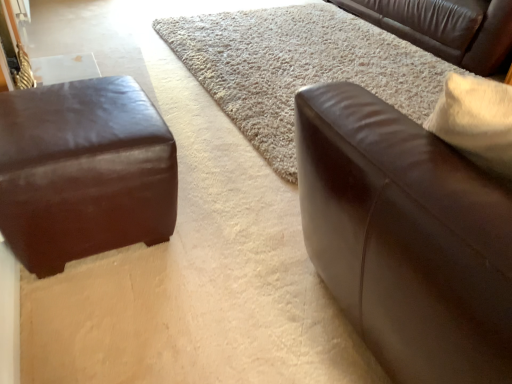
You are a GUI agent. You are given a task and a screenshot of the screen. Output one action in this format:
    pyautogui.click(x=<x>, y=<y>)
    Task: Click on the matte brown leather ottoman at left, positioned as the first studio couch in left-to-right order
    The width and height of the screenshot is (512, 384).
    Given the screenshot: What is the action you would take?
    pyautogui.click(x=84, y=171)

How much space does brown leather couch at upper right, acting as the 1th studio couch starting from the back, occupy vertically?

brown leather couch at upper right, acting as the 1th studio couch starting from the back, is 50.46 centimeters in height.

Where is `matte brown leather ottoman at left, arranged as the 2th studio couch when viewed from the back`? matte brown leather ottoman at left, arranged as the 2th studio couch when viewed from the back is located at coordinates (84, 171).

Is brown leather couch at upper right, the third studio couch from the left, positioned with its back to beige shag rug at center?

That's not correct — brown leather couch at upper right, the third studio couch from the left, is not looking away from beige shag rug at center.

From the image's perspective, which object appears higher, brown leather couch at upper right, acting as the third studio couch starting from the front, or beige shag rug at center?

brown leather couch at upper right, acting as the third studio couch starting from the front, from the image's perspective.

Does brown leather couch at upper right, which ranks as the 1th studio couch in right-to-left order, have a greater height compared to beige shag rug at center?

Correct, brown leather couch at upper right, which ranks as the 1th studio couch in right-to-left order, is much taller as beige shag rug at center.

Are brown leather couch at right, which ranks as the third studio couch in back-to-front order, and beige shag rug at center beside each other?

brown leather couch at right, which ranks as the third studio couch in back-to-front order, and beige shag rug at center are not in contact.

Who is bigger, brown leather couch at right, which ranks as the 1th studio couch in front-to-back order, or beige shag rug at center?

With larger size is brown leather couch at right, which ranks as the 1th studio couch in front-to-back order.

Considering the sizes of objects brown leather couch at right, acting as the 2th studio couch starting from the left, and beige shag rug at center in the image provided, who is taller, brown leather couch at right, acting as the 2th studio couch starting from the left, or beige shag rug at center?

brown leather couch at right, acting as the 2th studio couch starting from the left, is taller.

From a real-world perspective, which object rests below the other?

In real-world perspective, beige shag rug at center is lower.

Who is shorter, brown leather couch at right, arranged as the second studio couch when viewed from the right, or brown leather couch at upper right, which ranks as the 1th studio couch in right-to-left order?

With less height is brown leather couch at upper right, which ranks as the 1th studio couch in right-to-left order.

Who is bigger, brown leather couch at right, arranged as the second studio couch when viewed from the right, or brown leather couch at upper right, acting as the 1th studio couch starting from the back?

With larger size is brown leather couch at upper right, acting as the 1th studio couch starting from the back.

Considering the relative positions of brown leather couch at right, which ranks as the third studio couch in back-to-front order, and brown leather couch at upper right, which ranks as the 1th studio couch in right-to-left order, in the image provided, is brown leather couch at right, which ranks as the third studio couch in back-to-front order, to the left of brown leather couch at upper right, which ranks as the 1th studio couch in right-to-left order, from the viewer's perspective?

Yes.

From a real-world perspective, is brown leather couch at right, arranged as the second studio couch when viewed from the right, on top of brown leather couch at upper right, acting as the third studio couch starting from the front?

Yes, from a real-world perspective, brown leather couch at right, arranged as the second studio couch when viewed from the right, is on top of brown leather couch at upper right, acting as the third studio couch starting from the front.

Considering the sizes of brown leather couch at right, which ranks as the 1th studio couch in front-to-back order, and matte brown leather ottoman at left, positioned as the first studio couch in left-to-right order, in the image, is brown leather couch at right, which ranks as the 1th studio couch in front-to-back order, bigger or smaller than matte brown leather ottoman at left, positioned as the first studio couch in left-to-right order,?

In the image, brown leather couch at right, which ranks as the 1th studio couch in front-to-back order, appears to be larger than matte brown leather ottoman at left, positioned as the first studio couch in left-to-right order.

Considering the positions of point (435, 161) and point (100, 104), is point (435, 161) closer or farther from the camera than point (100, 104)?

Point (435, 161).

Can we say brown leather couch at right, which ranks as the 1th studio couch in front-to-back order, lies outside matte brown leather ottoman at left, which appears as the second studio couch when viewed from the front?

Absolutely, brown leather couch at right, which ranks as the 1th studio couch in front-to-back order, is external to matte brown leather ottoman at left, which appears as the second studio couch when viewed from the front.

Is brown leather couch at right, arranged as the second studio couch when viewed from the right, shorter than matte brown leather ottoman at left, which appears as the third studio couch when viewed from the right?

No.

Could you tell me if matte brown leather ottoman at left, which appears as the third studio couch when viewed from the right, is turned towards beige shag rug at center?

No, matte brown leather ottoman at left, which appears as the third studio couch when viewed from the right, is not facing towards beige shag rug at center.

From a real-world perspective, which is physically above, matte brown leather ottoman at left, which appears as the third studio couch when viewed from the right, or beige shag rug at center?

From a 3D spatial view, matte brown leather ottoman at left, which appears as the third studio couch when viewed from the right, is above.

From the image's perspective, is matte brown leather ottoman at left, which appears as the second studio couch when viewed from the front, located above beige shag rug at center?

No, from the image's perspective, matte brown leather ottoman at left, which appears as the second studio couch when viewed from the front, is not above beige shag rug at center.

How many degrees apart are the facing directions of matte brown leather ottoman at left, positioned as the first studio couch in left-to-right order, and beige shag rug at center?

1.88 degrees.

Is point (110, 129) closer or farther from the camera than point (414, 291)?

Point (110, 129) appears to be farther away from the viewer than point (414, 291).

Considering the sizes of objects matte brown leather ottoman at left, which appears as the second studio couch when viewed from the front, and brown leather couch at right, arranged as the second studio couch when viewed from the right, in the image provided, who is wider, matte brown leather ottoman at left, which appears as the second studio couch when viewed from the front, or brown leather couch at right, arranged as the second studio couch when viewed from the right,?

With larger width is brown leather couch at right, arranged as the second studio couch when viewed from the right.

Is matte brown leather ottoman at left, which appears as the third studio couch when viewed from the right, far from brown leather couch at right, arranged as the second studio couch when viewed from the right?

matte brown leather ottoman at left, which appears as the third studio couch when viewed from the right, is near brown leather couch at right, arranged as the second studio couch when viewed from the right, not far away.

From a real-world perspective, is matte brown leather ottoman at left, arranged as the 2th studio couch when viewed from the back, beneath brown leather couch at right, acting as the 2th studio couch starting from the left?

Yes.

Is brown leather couch at upper right, which ranks as the 1th studio couch in right-to-left order, situated inside matte brown leather ottoman at left, which appears as the third studio couch when viewed from the right, or outside?

brown leather couch at upper right, which ranks as the 1th studio couch in right-to-left order, is not inside matte brown leather ottoman at left, which appears as the third studio couch when viewed from the right, it's outside.

From a real-world perspective, is brown leather couch at upper right, acting as the third studio couch starting from the front, above or below matte brown leather ottoman at left, which appears as the third studio couch when viewed from the right?

brown leather couch at upper right, acting as the third studio couch starting from the front, is situated higher than matte brown leather ottoman at left, which appears as the third studio couch when viewed from the right, in the real world.

Is brown leather couch at upper right, which ranks as the 1th studio couch in right-to-left order, aimed at matte brown leather ottoman at left, which appears as the third studio couch when viewed from the right?

Yes, brown leather couch at upper right, which ranks as the 1th studio couch in right-to-left order, is turned towards matte brown leather ottoman at left, which appears as the third studio couch when viewed from the right.

You are a GUI agent. You are given a task and a screenshot of the screen. Output one action in this format:
    pyautogui.click(x=<x>, y=<y>)
    Task: Click on the 2nd studio couch counting from the right side of the beige shag rug at center
    
    Given the screenshot: What is the action you would take?
    pyautogui.click(x=445, y=27)

At what (x,y) coordinates should I click in order to perform the action: click on mat on the left of brown leather couch at right, acting as the 2th studio couch starting from the left. Please return your answer as a coordinate pair (x, y). The image size is (512, 384). Looking at the image, I should click on (297, 67).

From the image, which object appears to be farther from matte brown leather ottoman at left, which appears as the third studio couch when viewed from the right, brown leather couch at right, arranged as the second studio couch when viewed from the right, or brown leather couch at upper right, acting as the third studio couch starting from the front?

Based on the image, brown leather couch at upper right, acting as the third studio couch starting from the front, appears to be further to matte brown leather ottoman at left, which appears as the third studio couch when viewed from the right.

From the picture: Which object lies further to the anchor point brown leather couch at right, acting as the 2th studio couch starting from the left, brown leather couch at upper right, which ranks as the 1th studio couch in right-to-left order, or beige shag rug at center?

brown leather couch at upper right, which ranks as the 1th studio couch in right-to-left order.

Looking at the image, which one is located closer to brown leather couch at upper right, the third studio couch from the left, matte brown leather ottoman at left, which appears as the third studio couch when viewed from the right, or beige shag rug at center?

Based on the image, beige shag rug at center appears to be nearer to brown leather couch at upper right, the third studio couch from the left.

When comparing their distances from brown leather couch at right, arranged as the second studio couch when viewed from the right, does matte brown leather ottoman at left, arranged as the 2th studio couch when viewed from the back, or beige shag rug at center seem further?

Among the two, beige shag rug at center is located further to brown leather couch at right, arranged as the second studio couch when viewed from the right.

From the image, which object appears to be farther from brown leather couch at upper right, acting as the 1th studio couch starting from the back, beige shag rug at center or matte brown leather ottoman at left, positioned as the first studio couch in left-to-right order?

matte brown leather ottoman at left, positioned as the first studio couch in left-to-right order, is further to brown leather couch at upper right, acting as the 1th studio couch starting from the back.

Considering their positions, is brown leather couch at upper right, acting as the 1th studio couch starting from the back, positioned further to beige shag rug at center than brown leather couch at right, which ranks as the third studio couch in back-to-front order?

brown leather couch at right, which ranks as the third studio couch in back-to-front order, is positioned further to the anchor beige shag rug at center.

From the picture: When comparing their distances from brown leather couch at right, acting as the 2th studio couch starting from the left, does brown leather couch at upper right, the third studio couch from the left, or matte brown leather ottoman at left, positioned as the first studio couch in left-to-right order, seem further?

brown leather couch at upper right, the third studio couch from the left, is positioned further to the anchor brown leather couch at right, acting as the 2th studio couch starting from the left.

When comparing their distances from matte brown leather ottoman at left, which appears as the third studio couch when viewed from the right, does brown leather couch at upper right, acting as the 1th studio couch starting from the back, or brown leather couch at right, which ranks as the third studio couch in back-to-front order, seem further?

brown leather couch at upper right, acting as the 1th studio couch starting from the back, lies further to matte brown leather ottoman at left, which appears as the third studio couch when viewed from the right, than the other object.

The height and width of the screenshot is (384, 512). What are the coordinates of `studio couch located between brown leather couch at right, which ranks as the third studio couch in back-to-front order, and beige shag rug at center in the depth direction` in the screenshot? It's located at (84, 171).

Image resolution: width=512 pixels, height=384 pixels. In order to click on mat between matte brown leather ottoman at left, which appears as the third studio couch when viewed from the right, and brown leather couch at upper right, the third studio couch from the left, from left to right in this screenshot , I will do `click(297, 67)`.

Locate an element on the screen. This screenshot has width=512, height=384. studio couch situated between matte brown leather ottoman at left, which appears as the second studio couch when viewed from the front, and brown leather couch at upper right, which ranks as the 1th studio couch in right-to-left order, from left to right is located at coordinates (406, 238).

The width and height of the screenshot is (512, 384). What are the coordinates of `mat between brown leather couch at right, which ranks as the 1th studio couch in front-to-back order, and brown leather couch at upper right, acting as the third studio couch starting from the front, along the z-axis` in the screenshot? It's located at (297, 67).